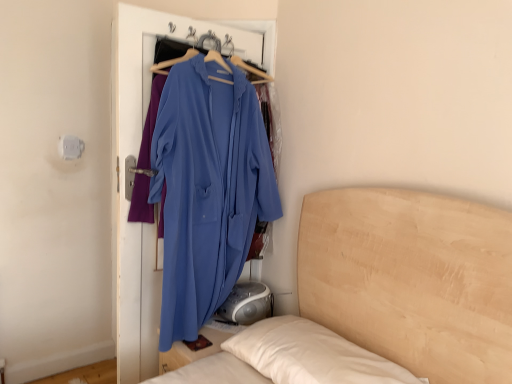
Question: Should I look upward or downward to see wooden bed at center?

Choices:
 (A) down
 (B) up

Answer: (A)

Question: Could wooden bed at center be considered to be inside matte blue robe at center?

Choices:
 (A) no
 (B) yes

Answer: (A)

Question: Would you say matte blue robe at center is outside wooden bed at center?

Choices:
 (A) yes
 (B) no

Answer: (A)

Question: Does matte blue robe at center have a greater width compared to wooden bed at center?

Choices:
 (A) no
 (B) yes

Answer: (A)

Question: Considering the relative positions of matte blue robe at center and wooden bed at center in the image provided, is matte blue robe at center to the right of wooden bed at center from the viewer's perspective?

Choices:
 (A) no
 (B) yes

Answer: (A)

Question: Considering the relative sizes of matte blue robe at center and wooden bed at center in the image provided, is matte blue robe at center thinner than wooden bed at center?

Choices:
 (A) no
 (B) yes

Answer: (B)

Question: Can you confirm if matte blue robe at center is bigger than wooden bed at center?

Choices:
 (A) yes
 (B) no

Answer: (B)

Question: Is wooden bed at center at the right side of matte blue robe at center?

Choices:
 (A) no
 (B) yes

Answer: (B)

Question: Does wooden bed at center come behind matte blue robe at center?

Choices:
 (A) yes
 (B) no

Answer: (B)

Question: Is wooden bed at center far from matte blue robe at center?

Choices:
 (A) no
 (B) yes

Answer: (A)

Question: From a real-world perspective, is wooden bed at center physically above matte blue robe at center?

Choices:
 (A) no
 (B) yes

Answer: (A)

Question: Is wooden bed at center oriented towards matte blue robe at center?

Choices:
 (A) no
 (B) yes

Answer: (A)

Question: Is wooden bed at center positioned beyond the bounds of matte blue robe at center?

Choices:
 (A) no
 (B) yes

Answer: (B)

Question: From a real-world perspective, is wooden bed at center physically located above or below matte blue robe at center?

Choices:
 (A) below
 (B) above

Answer: (A)